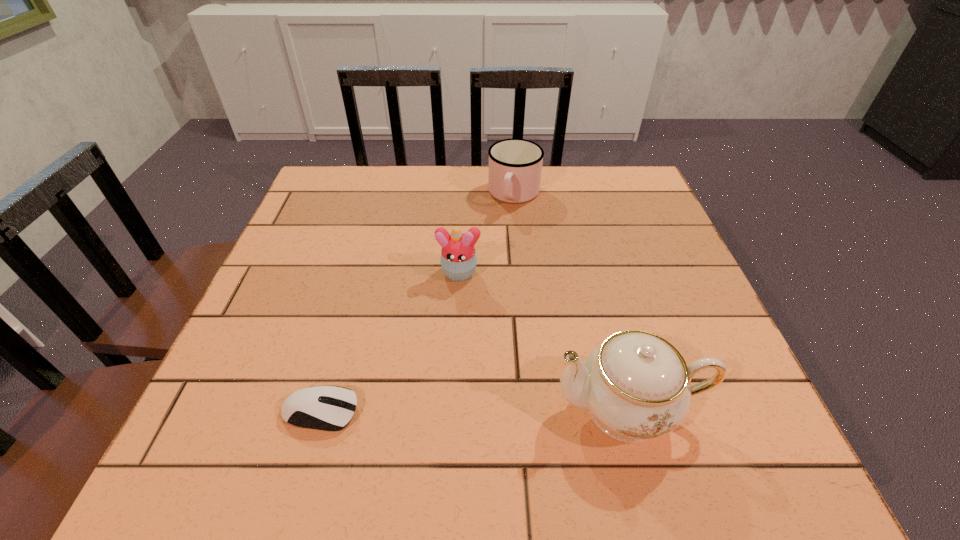
Image resolution: width=960 pixels, height=540 pixels. Find the location of `object that can be found as the third closest to the mug`. object that can be found as the third closest to the mug is located at coordinates (317, 407).

This screenshot has width=960, height=540. What are the coordinates of `vacant region that satisfies the following two spatial constraints: 1. on the back side of the shortest object; 2. on the left side of the farthest object` in the screenshot? It's located at coord(382,194).

I want to click on vacant area in the image that satisfies the following two spatial constraints: 1. on the front side of the cupcake; 2. at the spout of the tallest object, so click(451, 409).